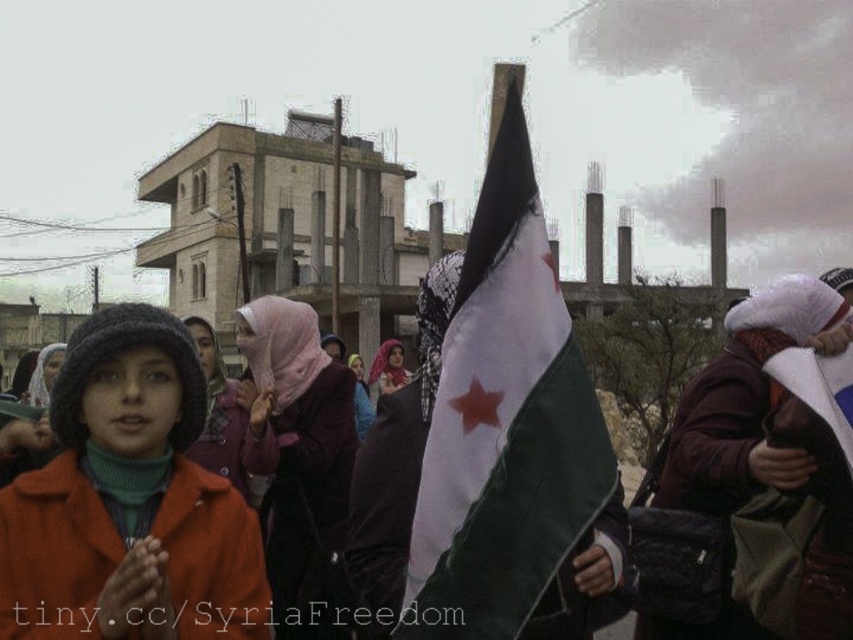
You are a photographer trying to capture a closeup shot of the pink fabric headscarf at center and the matte pink scarf at center. Given that your camera has a maximum focus range of 50 meters, can you capture both objects in a single focused shot?

The pink fabric headscarf at center is 49.31 meters from matte pink scarf at center. Since the distance between them is less than 50 meters, your camera can focus on both objects in a single shot.

You are a photographer at the protest scene. You want to capture a photo that includes both the pink fabric headscarf at center and the matte pink scarf at center. Which one should you position on the left side of your camera frame to ensure both are visible?

The pink fabric headscarf at center is already positioned on the left side of the matte pink scarf at center, so you should keep the pink fabric headscarf at center on the left side of your camera frame to ensure both are visible.

You are a photographer trying to capture a clear shot of both the white fabric flag at center and the matte pink scarf at center. Since you want both items to be visible in the frame, would adjusting your camera angle upwards or downwards help achieve this?

Since the white fabric flag at center is located above the matte pink scarf at center, adjusting your camera angle upwards would allow you to capture both items in the frame by including the higher position of the flag while still keeping the scarf visible below.